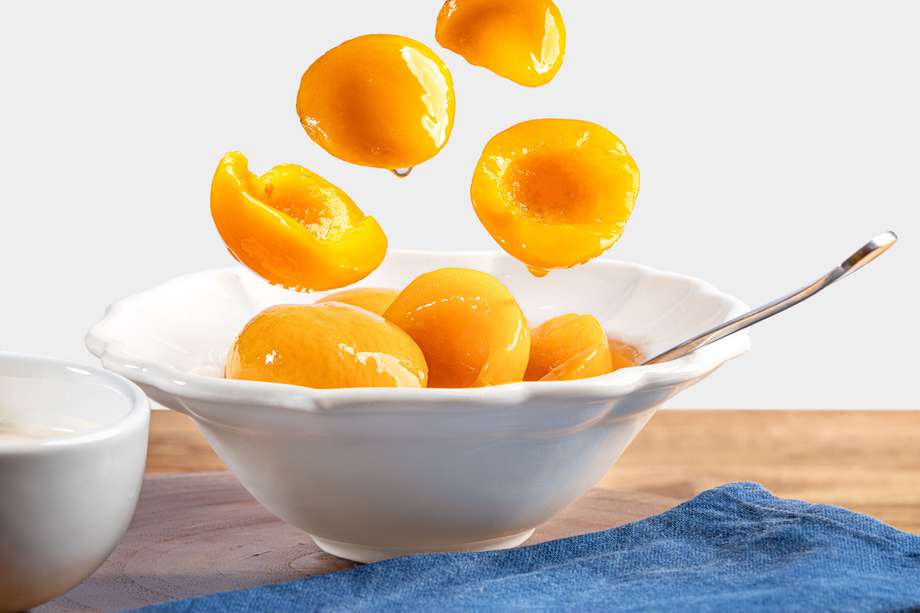
Where is `fruit in bowl`? fruit in bowl is located at coordinates (335, 351), (369, 305), (430, 313), (548, 352), (618, 345).